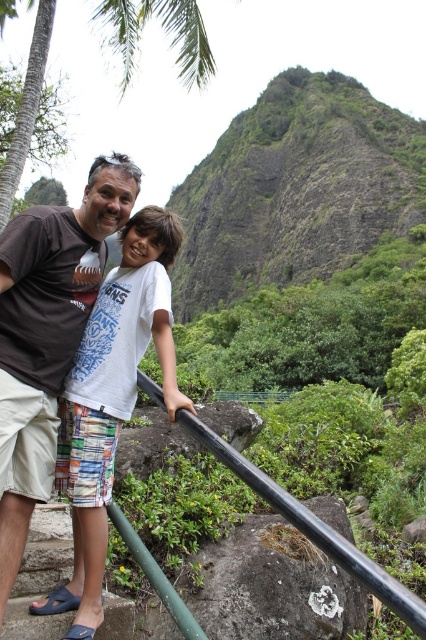
Is green rocky mountain at upper center wider than green leafy palm tree at upper left?

Indeed, green rocky mountain at upper center has a greater width compared to green leafy palm tree at upper left.

Does point (253, 260) come behind point (9, 168)?

Yes, point (253, 260) is behind point (9, 168).

The image size is (426, 640). Find the location of `green rocky mountain at upper center`. green rocky mountain at upper center is located at coordinates (296, 188).

Is point (403, 204) less distant than point (43, 227)?

No, (403, 204) is further to viewer.

Does green rocky mountain at upper center appear on the left side of brown cotton t-shirt at center?

In fact, green rocky mountain at upper center is to the right of brown cotton t-shirt at center.

Between point (271, 262) and point (71, 296), which one is positioned in front?

Point (71, 296) is in front.

Where is `green rocky mountain at upper center`? green rocky mountain at upper center is located at coordinates (296, 188).

Which is more to the left, brown cotton t-shirt at center or green leafy palm tree at upper left?

Positioned to the left is green leafy palm tree at upper left.

How distant is brown cotton t-shirt at center from green leafy palm tree at upper left?

brown cotton t-shirt at center is 13.24 meters from green leafy palm tree at upper left.

Is point (48, 358) farther from viewer compared to point (121, 8)?

No.

This screenshot has width=426, height=640. Identify the location of brown cotton t-shirt at center. (46, 333).